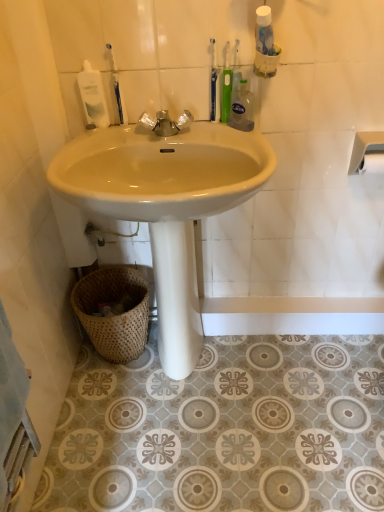
The width and height of the screenshot is (384, 512). What are the coordinates of `free location to the left of clear liquid soap at upper center` in the screenshot? It's located at (208, 131).